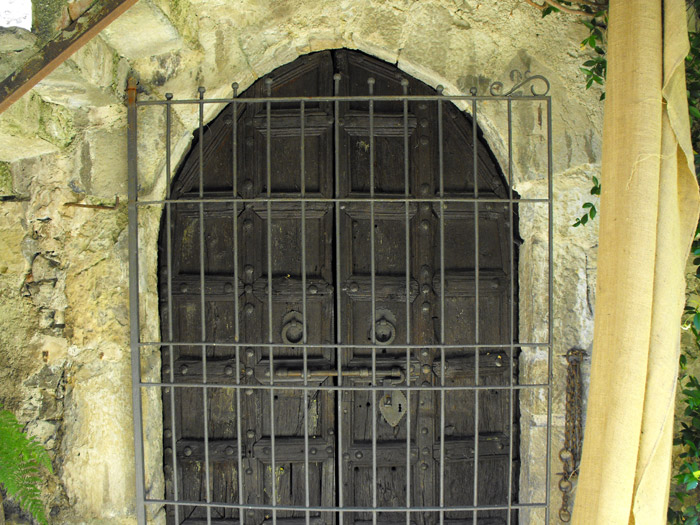
Locate an element on the screen. This screenshot has width=700, height=525. part of a leafy plant is located at coordinates (10, 455).